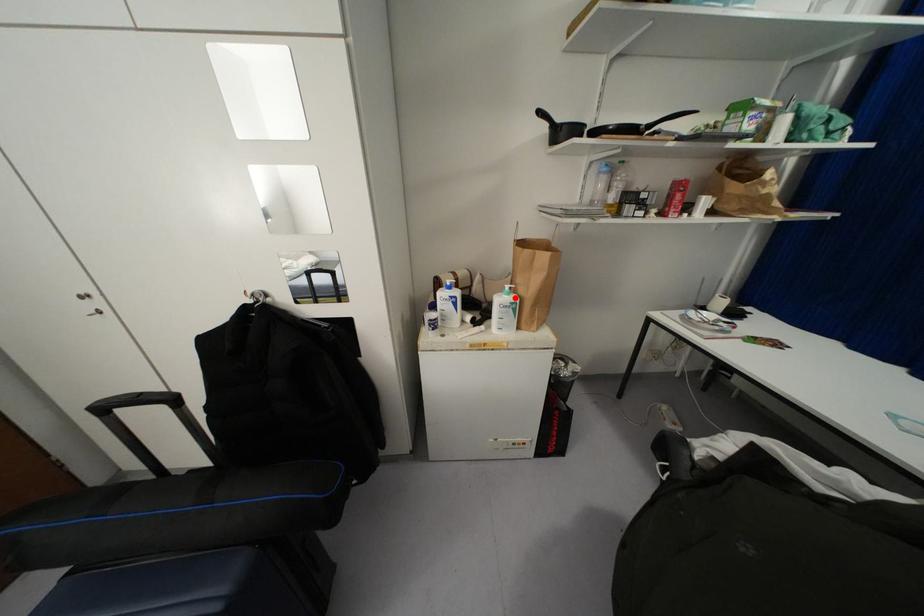
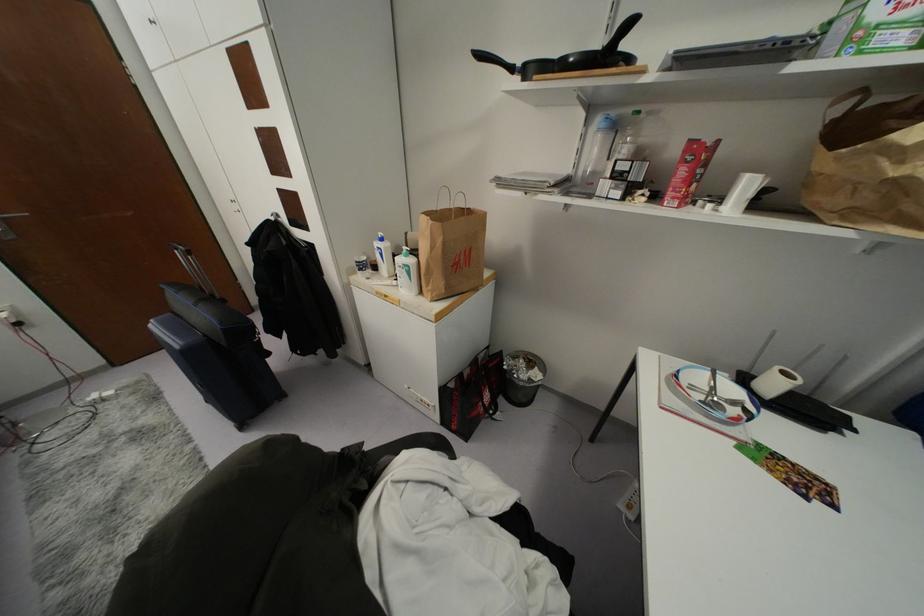
Where in the second image is the point corresponding to the highlighted location from the first image?

(410, 261)